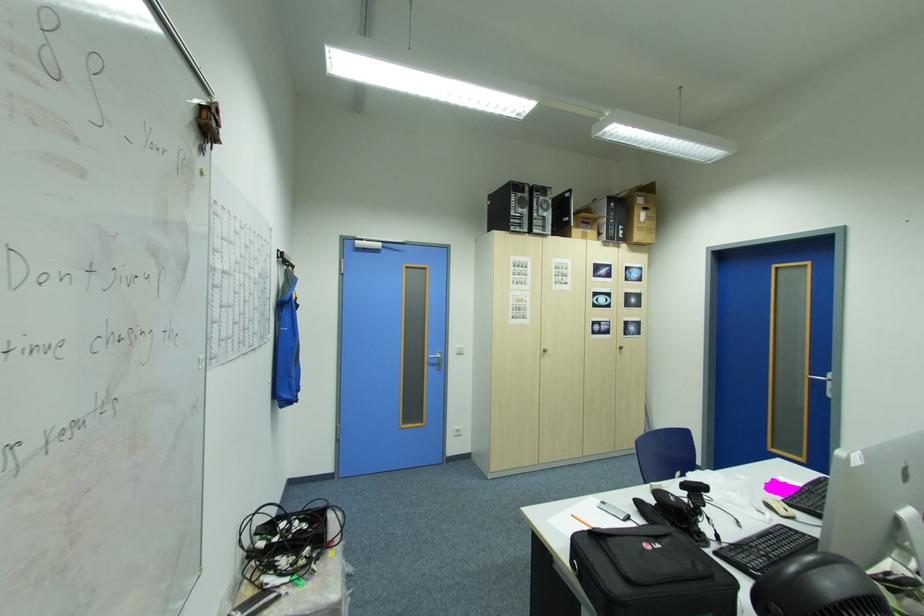
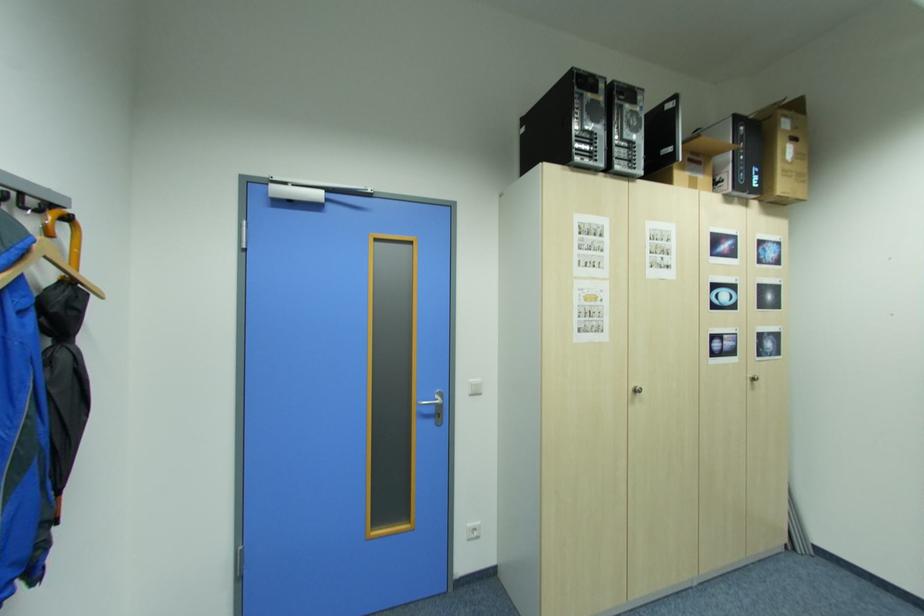
Locate, in the second image, the point that corresponds to point (627, 233) in the first image.

(762, 179)